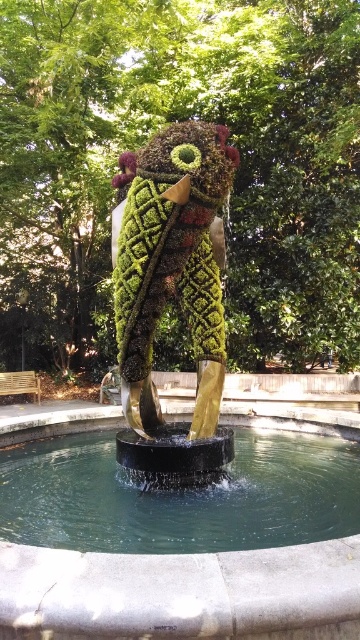
Is clear water at fountain center smaller than green mossy sculpture at center?

Yes, clear water at fountain center is smaller than green mossy sculpture at center.

The height and width of the screenshot is (640, 360). Describe the element at coordinates (180, 497) in the screenshot. I see `clear water at fountain center` at that location.

The height and width of the screenshot is (640, 360). What are the coordinates of `clear water at fountain center` in the screenshot? It's located at (180, 497).